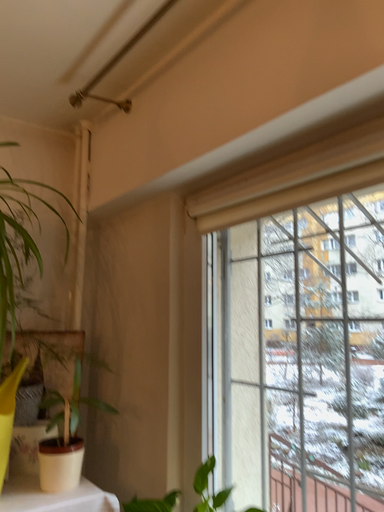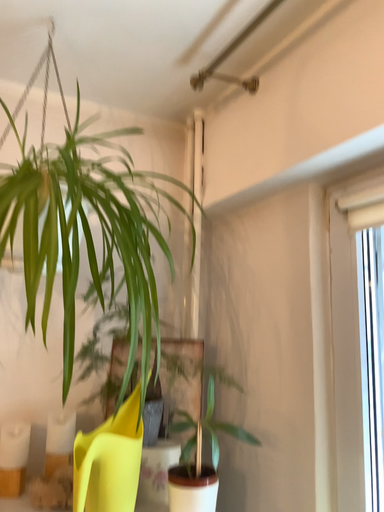
Question: How did the camera likely rotate when shooting the video?

Choices:
 (A) rotated right
 (B) rotated left

Answer: (B)